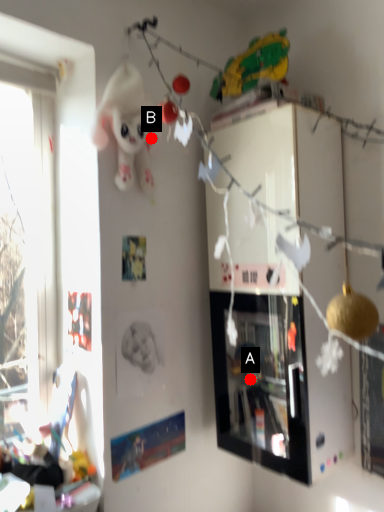
Question: Two points are circled on the image, labeled by A and B beside each circle. Which of the following is the farthest from the observer?

Choices:
 (A) A is further
 (B) B is further

Answer: (A)